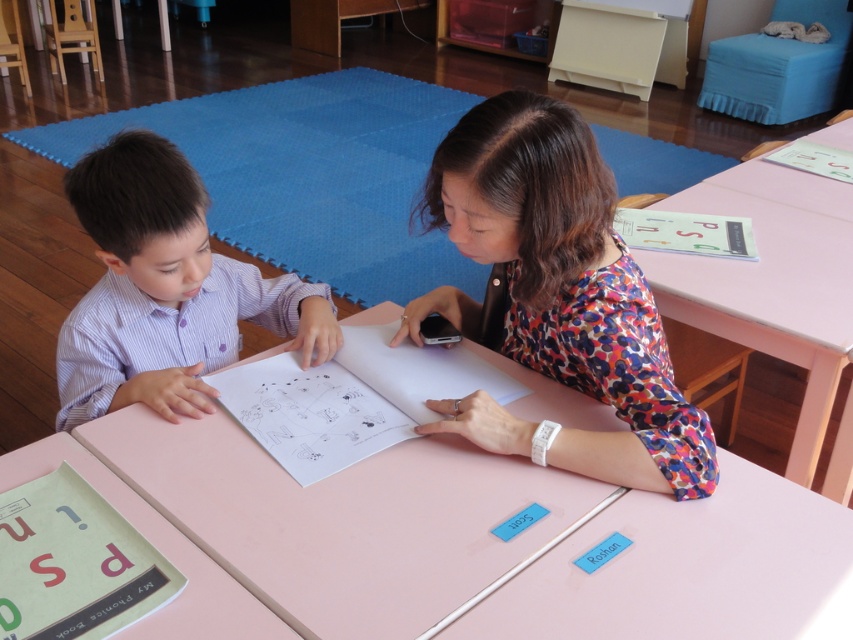
You are standing at the table in the classroom scene. There are two points marked on the table surface. The first point is at coordinates point (518, 266) and the second point is at point (833, 332). If you were to draw a line from your position to each point, which point would require you to move forward more from your starting position?

Point (833, 332) would require moving forward more because it is located behind point (518, 266), which is in front of it according to the description.

You are a visitor in the classroom and want to know where the pink wood table at center is located relative to the floral fabric blouse at center. Can you tell me which one is positioned lower?

The pink wood table at center is below floral fabric blouse at center, so the pink wood table at center is positioned lower than the floral fabric blouse at center.

You are organizing a classroom and need to place a large poster on the table that requires more surface area. Which table between the pink wood table at center and the pink wood table at upper right would be better suited for this task?

The pink wood table at upper right would be better suited for placing the large poster since it occupies more space than the pink wood table at center.